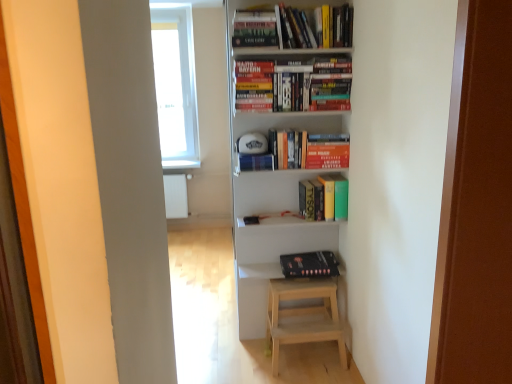
Describe the element at coordinates (325, 197) in the screenshot. I see `hardcover book at center, positioned as the third book in top-to-bottom order` at that location.

Measure the distance between point (344, 81) and camera.

Point (344, 81) is 7.58 feet from camera.

Identify the location of hardcover books at upper center, the 4th book from the bottom. (293, 27).

The image size is (512, 384). Identify the location of hardcover book at upper center. (327, 151).

This screenshot has width=512, height=384. Identify the location of book to the left of white matte bookcase at center. (293, 27).

Between white matte bookcase at center and hardcover books at upper center, which is counted as the first book, starting from the top, which one has more height?

white matte bookcase at center is taller.

Is white matte bookcase at center spatially inside hardcover books at upper center, which is counted as the first book, starting from the top, or outside of it?

white matte bookcase at center is not inside hardcover books at upper center, which is counted as the first book, starting from the top, it's outside.

From the image's perspective, which one is positioned lower, white matte bookcase at center or hardcover books at upper center, which is counted as the first book, starting from the top?

white matte bookcase at center is shown below in the image.

Between transparent plastic window sill at upper center and hardcover book at center, marked as the second book in a bottom-to-top arrangement, which one is positioned behind?

transparent plastic window sill at upper center.

From a real-world perspective, who is located higher, transparent plastic window sill at upper center or hardcover book at center, positioned as the third book in top-to-bottom order?

hardcover book at center, positioned as the third book in top-to-bottom order, is physically above.

Is transparent plastic window sill at upper center to the right of hardcover book at center, positioned as the third book in top-to-bottom order, from the viewer's perspective?

No, transparent plastic window sill at upper center is not to the right of hardcover book at center, positioned as the third book in top-to-bottom order.

Between point (180, 164) and point (322, 208), which one is positioned behind?

The point (180, 164) is behind.

Which is more to the left, hardcover book at upper center or black matte book at lower center, which appears as the 4th book when viewed from the top?

black matte book at lower center, which appears as the 4th book when viewed from the top.

From the image's perspective, does hardcover book at upper center appear lower than black matte book at lower center, which appears as the 4th book when viewed from the top?

No, from the image's perspective, hardcover book at upper center is not beneath black matte book at lower center, which appears as the 4th book when viewed from the top.

Is hardcover book at upper center smaller than black matte book at lower center, which appears as the 4th book when viewed from the top?

Yes, hardcover book at upper center is smaller than black matte book at lower center, which appears as the 4th book when viewed from the top.

Between hardcover book at upper center and black matte book at lower center, which appears as the 4th book when viewed from the top, which one is positioned behind?

black matte book at lower center, which appears as the 4th book when viewed from the top, is behind.

Can you confirm if white matte bookcase at center is positioned to the right of hardcover book at upper center?

No, white matte bookcase at center is not to the right of hardcover book at upper center.

Is white matte bookcase at center smaller than hardcover book at upper center?

Actually, white matte bookcase at center might be larger than hardcover book at upper center.

Does white matte bookcase at center have a lesser height compared to hardcover book at upper center?

No, white matte bookcase at center is not shorter than hardcover book at upper center.

From a real-world perspective, which object rests below the other?

black matte book at lower center, which appears as the 4th book when viewed from the top, from a real-world perspective.

In terms of height, does black matte book at lower center, which appears as the 4th book when viewed from the top, look taller or shorter compared to hardcover book at center, marked as the second book in a bottom-to-top arrangement?

black matte book at lower center, which appears as the 4th book when viewed from the top, is shorter than hardcover book at center, marked as the second book in a bottom-to-top arrangement.

From the image's perspective, which one is positioned higher, black matte book at lower center, arranged as the 1th book when ordered from the bottom, or hardcover book at center, marked as the second book in a bottom-to-top arrangement?

hardcover book at center, marked as the second book in a bottom-to-top arrangement, is shown above in the image.

Is black matte book at lower center, which appears as the 4th book when viewed from the top, positioned with its back to hardcover book at center, marked as the second book in a bottom-to-top arrangement?

No, black matte book at lower center, which appears as the 4th book when viewed from the top, is not facing the opposite direction of hardcover book at center, marked as the second book in a bottom-to-top arrangement.

Would you say white matte bookcase at center is a long distance from hardcover book at center, marked as the second book in a bottom-to-top arrangement?

They are positioned close to each other.

Considering the relative sizes of white matte bookcase at center and hardcover book at center, positioned as the third book in top-to-bottom order, in the image provided, is white matte bookcase at center smaller than hardcover book at center, positioned as the third book in top-to-bottom order,?

No, white matte bookcase at center is not smaller than hardcover book at center, positioned as the third book in top-to-bottom order.

Which is correct: white matte bookcase at center is inside hardcover book at center, positioned as the third book in top-to-bottom order, or outside of it?

white matte bookcase at center is not enclosed by hardcover book at center, positioned as the third book in top-to-bottom order.

Between white matte bookcase at center and hardcover book at center, marked as the second book in a bottom-to-top arrangement, which one has larger width?

white matte bookcase at center.

Who is taller, hardcover book at center, positioned as the third book in top-to-bottom order, or black matte book at lower center, which appears as the 4th book when viewed from the top?

Standing taller between the two is hardcover book at center, positioned as the third book in top-to-bottom order.

Considering the relative sizes of hardcover book at center, marked as the second book in a bottom-to-top arrangement, and black matte book at lower center, arranged as the 1th book when ordered from the bottom, in the image provided, is hardcover book at center, marked as the second book in a bottom-to-top arrangement, thinner than black matte book at lower center, arranged as the 1th book when ordered from the bottom,?

Correct, the width of hardcover book at center, marked as the second book in a bottom-to-top arrangement, is less than that of black matte book at lower center, arranged as the 1th book when ordered from the bottom.

Choose the correct answer: Is hardcover book at center, positioned as the third book in top-to-bottom order, inside black matte book at lower center, arranged as the 1th book when ordered from the bottom, or outside it?

hardcover book at center, positioned as the third book in top-to-bottom order, is not enclosed by black matte book at lower center, arranged as the 1th book when ordered from the bottom.

Is point (337, 200) positioned after point (336, 272)?

No, it is not.

The height and width of the screenshot is (384, 512). Find the location of `the 2nd book above the white matte bookcase at center (from the image's perspective)`. the 2nd book above the white matte bookcase at center (from the image's perspective) is located at coordinates (293, 27).

Which book is the 4th one when counting from the right side of the transparent plastic window sill at upper center? Please provide its 2D coordinates.

[(325, 197)]

When comparing their distances from hardcover book at upper center, does hardcover books at upper center, marked as the 2th book in a top-to-bottom arrangement, or hardcover books at upper center, which is counted as the first book, starting from the top, seem further?

Based on the image, hardcover books at upper center, which is counted as the first book, starting from the top, appears to be further to hardcover book at upper center.

Which object lies further to the anchor point hardcover books at upper center, which is counted as the first book, starting from the top, white matte bookcase at center or hardcover book at center, marked as the second book in a bottom-to-top arrangement?

Based on the image, hardcover book at center, marked as the second book in a bottom-to-top arrangement, appears to be further to hardcover books at upper center, which is counted as the first book, starting from the top.

Estimate the real-world distances between objects in this image. Which object is closer to hardcover book at upper center, white matte bookcase at center or hardcover book at center, marked as the second book in a bottom-to-top arrangement?

Among the two, hardcover book at center, marked as the second book in a bottom-to-top arrangement, is located nearer to hardcover book at upper center.

Estimate the real-world distances between objects in this image. Which object is further from hardcover book at upper center, hardcover books at upper center, the 4th book from the bottom, or white matte bookcase at center?

Based on the image, hardcover books at upper center, the 4th book from the bottom, appears to be further to hardcover book at upper center.

Estimate the real-world distances between objects in this image. Which object is closer to transparent plastic window sill at upper center, hardcover books at upper center, the 4th book from the bottom, or hardcover book at center, positioned as the third book in top-to-bottom order?

hardcover book at center, positioned as the third book in top-to-bottom order, lies closer to transparent plastic window sill at upper center than the other object.

Considering their positions, is hardcover books at upper center, the 4th book from the bottom, positioned further to black matte book at lower center, which appears as the 4th book when viewed from the top, than white matte bookcase at center?

hardcover books at upper center, the 4th book from the bottom.

From the picture: From the image, which object appears to be farther from hardcover books at upper center, the 4th book from the bottom, transparent plastic window sill at upper center or hardcover book at upper center?

transparent plastic window sill at upper center is further to hardcover books at upper center, the 4th book from the bottom.

In the scene shown: Estimate the real-world distances between objects in this image. Which object is closer to black matte book at lower center, arranged as the 1th book when ordered from the bottom, hardcover book at upper center or hardcover books at upper center, marked as the 2th book in a top-to-bottom arrangement?

hardcover book at upper center lies closer to black matte book at lower center, arranged as the 1th book when ordered from the bottom, than the other object.

Where is `book between hardcover books at upper center, the 4th book from the bottom, and hardcover book at center, marked as the second book in a bottom-to-top arrangement, in the up-down direction`? The height and width of the screenshot is (384, 512). book between hardcover books at upper center, the 4th book from the bottom, and hardcover book at center, marked as the second book in a bottom-to-top arrangement, in the up-down direction is located at coordinates (294, 84).

What are the coordinates of `book between hardcover books at upper center, marked as the 2th book in a top-to-bottom arrangement, and black matte book at lower center, which appears as the 4th book when viewed from the top, vertically` in the screenshot? It's located at (325, 197).

Image resolution: width=512 pixels, height=384 pixels. Find the location of `paperback book between hardcover books at upper center, the 4th book from the bottom, and hardcover book at center, positioned as the third book in top-to-bottom order, in the up-down direction`. paperback book between hardcover books at upper center, the 4th book from the bottom, and hardcover book at center, positioned as the third book in top-to-bottom order, in the up-down direction is located at coordinates (327, 151).

I want to click on book between hardcover books at upper center, the 4th book from the bottom, and hardcover book at upper center from top to bottom, so click(294, 84).